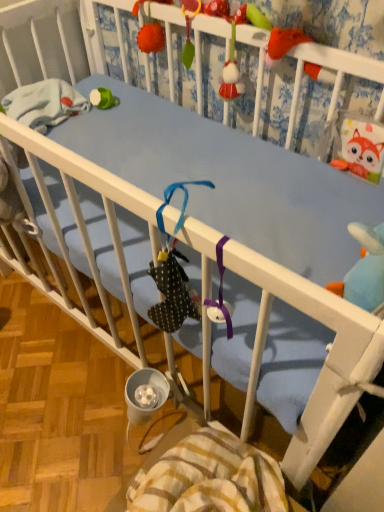
Question: Can you confirm if fluffy orange pom-pom at upper center is thinner than striped cotton blanket at lower center?

Choices:
 (A) yes
 (B) no

Answer: (A)

Question: Are fluffy orange pom-pom at upper center and striped cotton blanket at lower center far apart?

Choices:
 (A) no
 (B) yes

Answer: (B)

Question: Is fluffy orange pom-pom at upper center next to striped cotton blanket at lower center?

Choices:
 (A) no
 (B) yes

Answer: (A)

Question: Can you confirm if fluffy orange pom-pom at upper center is shorter than striped cotton blanket at lower center?

Choices:
 (A) no
 (B) yes

Answer: (B)

Question: Does fluffy orange pom-pom at upper center have a greater height compared to striped cotton blanket at lower center?

Choices:
 (A) yes
 (B) no

Answer: (B)

Question: From a real-world perspective, is blue fabric crib at upper center physically located above or below fluffy orange pom-pom at upper center?

Choices:
 (A) below
 (B) above

Answer: (A)

Question: Considering the positions of blue fabric crib at upper center and fluffy orange pom-pom at upper center in the image, is blue fabric crib at upper center wider or thinner than fluffy orange pom-pom at upper center?

Choices:
 (A) thin
 (B) wide

Answer: (A)

Question: Is blue fabric crib at upper center taller or shorter than fluffy orange pom-pom at upper center?

Choices:
 (A) tall
 (B) short

Answer: (A)

Question: Which is correct: blue fabric crib at upper center is inside fluffy orange pom-pom at upper center, or outside of it?

Choices:
 (A) outside
 (B) inside

Answer: (A)

Question: Considering the positions of point (140, 3) and point (190, 508), is point (140, 3) closer or farther from the camera than point (190, 508)?

Choices:
 (A) closer
 (B) farther

Answer: (B)

Question: From a real-world perspective, is fluffy orange pom-pom at upper center above or below striped cotton blanket at lower center?

Choices:
 (A) below
 (B) above

Answer: (B)

Question: Based on their sizes in the image, would you say fluffy orange pom-pom at upper center is bigger or smaller than striped cotton blanket at lower center?

Choices:
 (A) big
 (B) small

Answer: (B)

Question: In terms of height, does fluffy orange pom-pom at upper center look taller or shorter compared to striped cotton blanket at lower center?

Choices:
 (A) short
 (B) tall

Answer: (A)

Question: From a real-world perspective, is blue fabric crib at upper center physically located above or below striped cotton blanket at lower center?

Choices:
 (A) above
 (B) below

Answer: (A)

Question: From the image's perspective, relative to striped cotton blanket at lower center, is blue fabric crib at upper center above or below?

Choices:
 (A) below
 (B) above

Answer: (B)